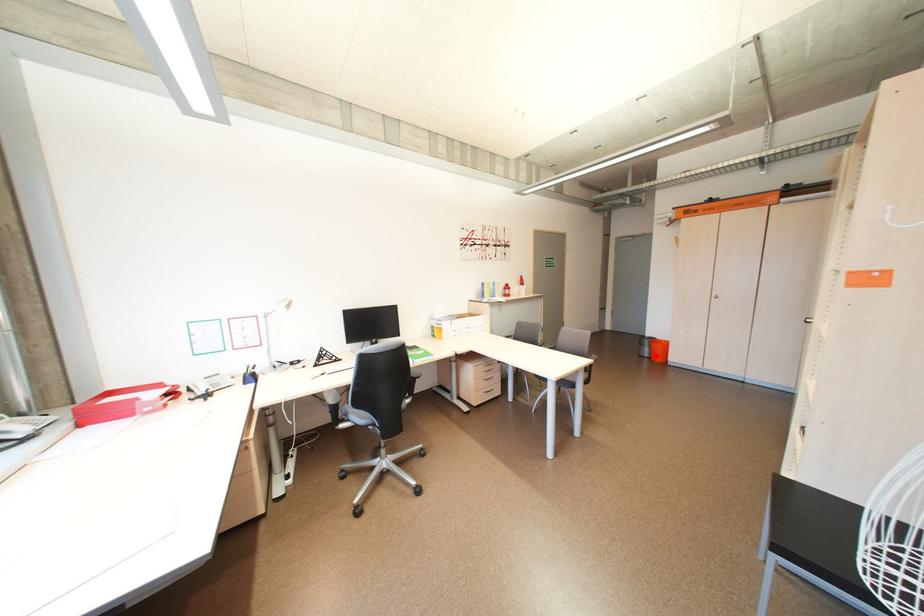
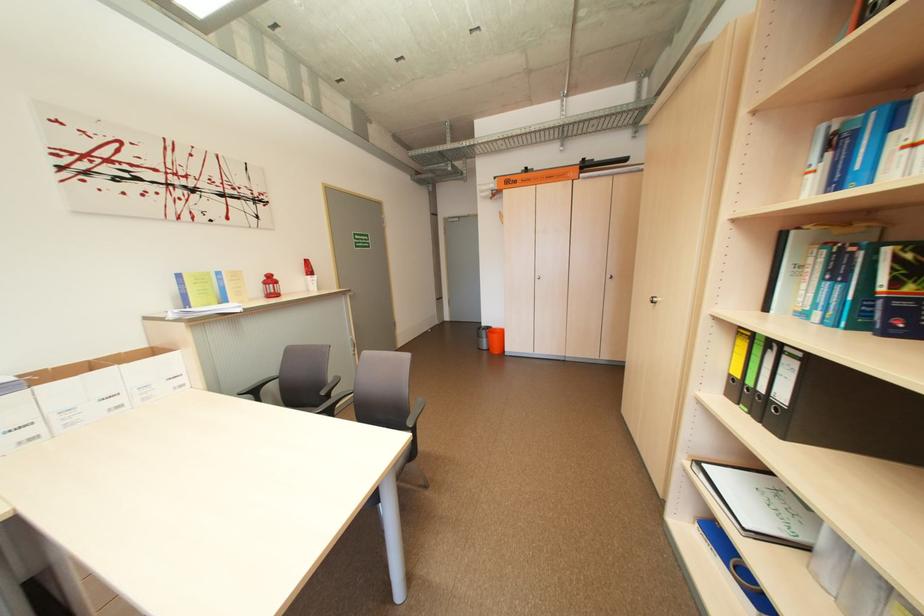
The point at the highlighted location is marked in the first image. Where is the corresponding point in the second image?

(494, 347)